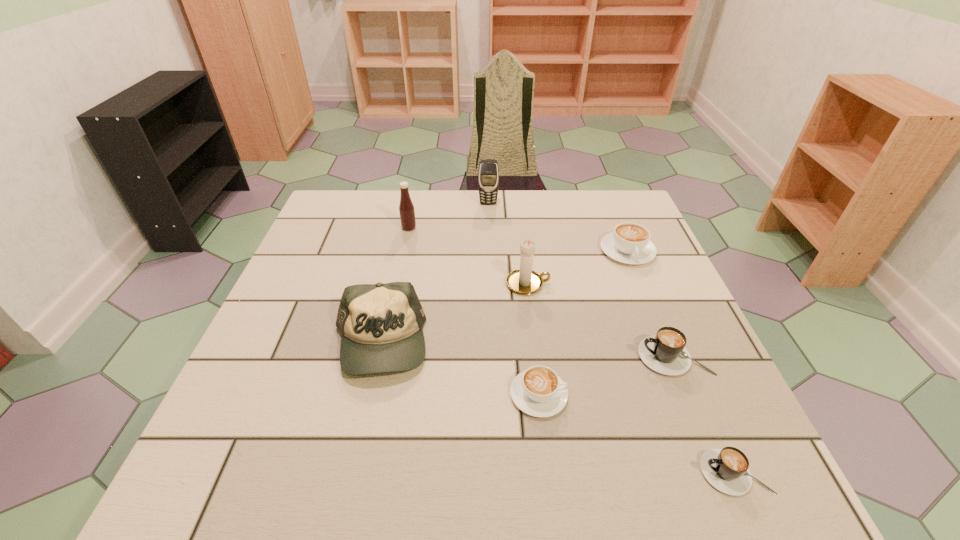
Identify the location of free spot between the Tabasco sauce and the leftmost cappuccino. (474, 312).

The image size is (960, 540). I want to click on empty space that is in between the candle holder and the fifth shortest object, so click(453, 314).

At what (x,y) coordinates should I click in order to perform the action: click on free spot between the white Tabasco sauce and the fourth farthest object. Please return your answer as a coordinate pair (x, y). Looking at the image, I should click on (468, 256).

I want to click on unoccupied position between the farther black cappuccino and the cellular telephone, so click(x=581, y=280).

Find the location of a particular element. vacant area that lies between the baseball cap and the leftmost cappuccino is located at coordinates (459, 369).

At what (x,y) coordinates should I click in order to perform the action: click on free space between the bigger white cappuccino and the fourth tallest object. Please return your answer as a coordinate pair (x, y). Looking at the image, I should click on (503, 298).

This screenshot has height=540, width=960. In order to click on vacant area between the leftmost cappuccino and the farthest object in this screenshot , I will do `click(514, 299)`.

The height and width of the screenshot is (540, 960). What are the coordinates of `free space between the white candle holder and the smaller white cappuccino` in the screenshot? It's located at (533, 340).

Image resolution: width=960 pixels, height=540 pixels. I want to click on vacant area that lies between the farther black cappuccino and the right white cappuccino, so click(x=650, y=304).

Choose which object is the fourth nearest neighbor to the bigger white cappuccino. Please provide its 2D coordinates. Your answer should be formatted as a tuple, i.e. [(x, y)], where the tuple contains the x and y coordinates of a point satisfying the conditions above.

[(538, 391)]